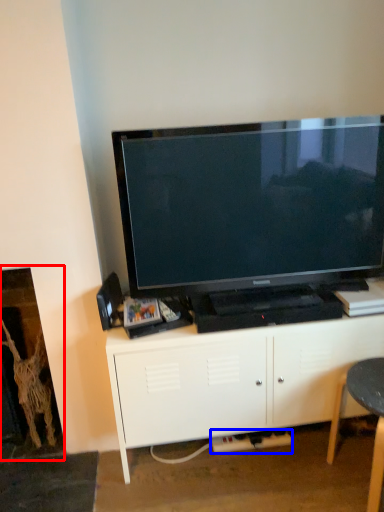
Question: Which point is further to the camera, fireplace (highlighted by a red box) or plug (highlighted by a blue box)?

Choices:
 (A) fireplace
 (B) plug

Answer: (B)